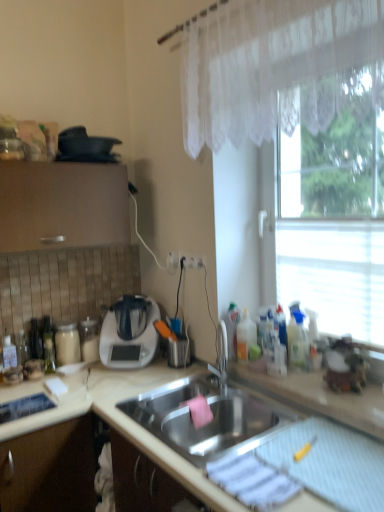
This screenshot has height=512, width=384. What do you see at coordinates (208, 423) in the screenshot?
I see `stainless steel sink at center` at bounding box center [208, 423].

How much space does black matte pan at upper left, marked as the 1th appliance in a top-to-bottom arrangement, occupy horizontally?

black matte pan at upper left, marked as the 1th appliance in a top-to-bottom arrangement, is 9.04 inches in width.

Identify the location of black matte pan at upper left, marked as the 1th appliance in a top-to-bottom arrangement. (85, 147).

This screenshot has height=512, width=384. What are the coordinates of `white lace curtain at upper right` in the screenshot? It's located at (271, 65).

In the scene shown: What is the approximate width of white plastic electric outlet at center?

6.58 centimeters.

I want to click on transparent glass window at right, so click(x=334, y=222).

At what (x,y) coordinates should I click in order to perform the action: click on stainless steel sink at center. Please return your answer as a coordinate pair (x, y). This screenshot has width=384, height=512. Looking at the image, I should click on (208, 423).

Locate an element on the screen. The width and height of the screenshot is (384, 512). appliance that appears below the transparent glass window at right (from the image's perspective) is located at coordinates (129, 333).

Between transparent glass window at right and white plastic appliance at center-left, which is counted as the first appliance, starting from the bottom, which one has more height?

transparent glass window at right.

Between transparent glass window at right and white plastic appliance at center-left, which is the second appliance in top-to-bottom order, which one has larger size?

transparent glass window at right is bigger.

Is white plastic electric outlet at center bigger or smaller than white lace curtain at upper right?

white plastic electric outlet at center is smaller than white lace curtain at upper right.

Can you confirm if white plastic electric outlet at center is shorter than white lace curtain at upper right?

Yes.

Locate an element on the screen. The width and height of the screenshot is (384, 512). electric outlet that appears on the left of white lace curtain at upper right is located at coordinates (185, 262).

What's the angular difference between stainless steel sink at center and white plastic electric outlet at center's facing directions?

The angle between the facing direction of stainless steel sink at center and the facing direction of white plastic electric outlet at center is 1.13 degrees.

Does stainless steel sink at center come in front of white plastic electric outlet at center?

That is True.

Which of these two, stainless steel sink at center or white plastic electric outlet at center, is bigger?

stainless steel sink at center is bigger.

Would you say white lace curtain at upper right is a long distance from black matte pan at upper left, marked as the 2th appliance in a bottom-to-top arrangement?

Actually, white lace curtain at upper right and black matte pan at upper left, marked as the 2th appliance in a bottom-to-top arrangement, are a little close together.

From the image's perspective, which is below, white lace curtain at upper right or black matte pan at upper left, marked as the 2th appliance in a bottom-to-top arrangement?

black matte pan at upper left, marked as the 2th appliance in a bottom-to-top arrangement, from the image's perspective.

Considering the relative sizes of white lace curtain at upper right and black matte pan at upper left, marked as the 1th appliance in a top-to-bottom arrangement, in the image provided, is white lace curtain at upper right taller than black matte pan at upper left, marked as the 1th appliance in a top-to-bottom arrangement,?

Yes, white lace curtain at upper right is taller than black matte pan at upper left, marked as the 1th appliance in a top-to-bottom arrangement.

From a real-world perspective, is white lace curtain at upper right located higher than black matte pan at upper left, marked as the 2th appliance in a bottom-to-top arrangement?

Yes, from a real-world perspective, white lace curtain at upper right is over black matte pan at upper left, marked as the 2th appliance in a bottom-to-top arrangement

From a real-world perspective, is white plastic electric outlet at center positioned over beige matte countertop at center based on gravity?

Indeed, from a real-world perspective, white plastic electric outlet at center stands above beige matte countertop at center.

From the image's perspective, would you say white plastic electric outlet at center is positioned over beige matte countertop at center?

Yes, from the image's perspective, white plastic electric outlet at center is on top of beige matte countertop at center.

Considering the relative sizes of white plastic electric outlet at center and beige matte countertop at center in the image provided, is white plastic electric outlet at center taller than beige matte countertop at center?

Incorrect, the height of white plastic electric outlet at center is not larger of that of beige matte countertop at center.

Is beige matte countertop at center at the back of white plastic electric outlet at center?

No, white plastic electric outlet at center's orientation is not away from beige matte countertop at center.

From the picture: Can you tell me how much white plastic appliance at center-left, which is counted as the first appliance, starting from the bottom, and white lace curtain at upper right differ in facing direction?

The angular difference between white plastic appliance at center-left, which is counted as the first appliance, starting from the bottom, and white lace curtain at upper right is 131 degrees.

From the picture: Between white plastic appliance at center-left, which is the second appliance in top-to-bottom order, and white lace curtain at upper right, which one has larger size?

white lace curtain at upper right is bigger.

Does point (108, 327) come closer to viewer compared to point (270, 3)?

No, (108, 327) is behind (270, 3).

Looking at this image, what's the angular difference between white plastic appliance at center-left, which is counted as the first appliance, starting from the bottom, and beige matte countertop at center's facing directions?

48.2 degrees separate the facing orientations of white plastic appliance at center-left, which is counted as the first appliance, starting from the bottom, and beige matte countertop at center.

Is white plastic appliance at center-left, which is counted as the first appliance, starting from the bottom, positioned with its back to beige matte countertop at center?

No.

Which is in front, point (124, 317) or point (300, 500)?

The point (300, 500) is closer to the camera.

Identify the location of appliance below the transparent glass window at right (from a real-world perspective). (129, 333).

Where is `curtain above the white plastic electric outlet at center (from the image's perspective)`? The width and height of the screenshot is (384, 512). curtain above the white plastic electric outlet at center (from the image's perspective) is located at coordinates (271, 65).

Which object lies further to the anchor point stainless steel sink at center, beige matte countertop at center or black matte pan at upper left, marked as the 1th appliance in a top-to-bottom arrangement?

The object further to stainless steel sink at center is black matte pan at upper left, marked as the 1th appliance in a top-to-bottom arrangement.

Estimate the real-world distances between objects in this image. Which object is closer to stainless steel sink at center, black matte pan at upper left, marked as the 2th appliance in a bottom-to-top arrangement, or transparent glass window at right?

transparent glass window at right.

Considering their positions, is white plastic appliance at center-left, which is counted as the first appliance, starting from the bottom, positioned closer to stainless steel sink at center than beige matte countertop at center?

beige matte countertop at center is closer to stainless steel sink at center.

Which object lies further to the anchor point white plastic appliance at center-left, which is counted as the first appliance, starting from the bottom, transparent glass window at right or stainless steel sink at center?

transparent glass window at right lies further to white plastic appliance at center-left, which is counted as the first appliance, starting from the bottom, than the other object.

From the image, which object appears to be farther from stainless steel sink at center, white lace curtain at upper right or beige matte countertop at center?

Among the two, white lace curtain at upper right is located further to stainless steel sink at center.

Considering their positions, is stainless steel sink at center positioned closer to white plastic appliance at center-left, which is counted as the first appliance, starting from the bottom, than beige matte countertop at center?

Based on the image, beige matte countertop at center appears to be nearer to white plastic appliance at center-left, which is counted as the first appliance, starting from the bottom.

Estimate the real-world distances between objects in this image. Which object is further from white plastic electric outlet at center, white lace curtain at upper right or black matte pan at upper left, marked as the 1th appliance in a top-to-bottom arrangement?

Based on the image, white lace curtain at upper right appears to be further to white plastic electric outlet at center.

From the picture: Considering their positions, is white plastic appliance at center-left, which is the second appliance in top-to-bottom order, positioned further to white plastic electric outlet at center than white lace curtain at upper right?

Among the two, white lace curtain at upper right is located further to white plastic electric outlet at center.

Locate an element on the screen. Image resolution: width=384 pixels, height=512 pixels. window that lies between white lace curtain at upper right and white plastic appliance at center-left, which is the second appliance in top-to-bottom order, from top to bottom is located at coordinates (334, 222).

What are the coordinates of `window between white lace curtain at upper right and white plastic electric outlet at center from front to back` in the screenshot? It's located at (334, 222).

In order to click on sink that lies between black matte pan at upper left, marked as the 2th appliance in a bottom-to-top arrangement, and beige matte countertop at center from top to bottom in this screenshot , I will do `click(208, 423)`.

The height and width of the screenshot is (512, 384). I want to click on appliance between black matte pan at upper left, marked as the 1th appliance in a top-to-bottom arrangement, and transparent glass window at right, in the horizontal direction, so click(x=129, y=333).